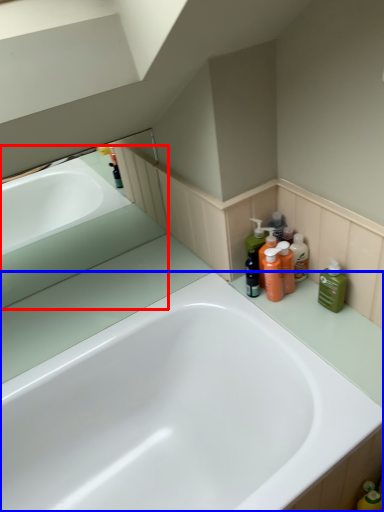
Question: Which of the following is the farthest to the observer, bath (highlighted by a red box) or bathtub (highlighted by a blue box)?

Choices:
 (A) bath
 (B) bathtub

Answer: (A)